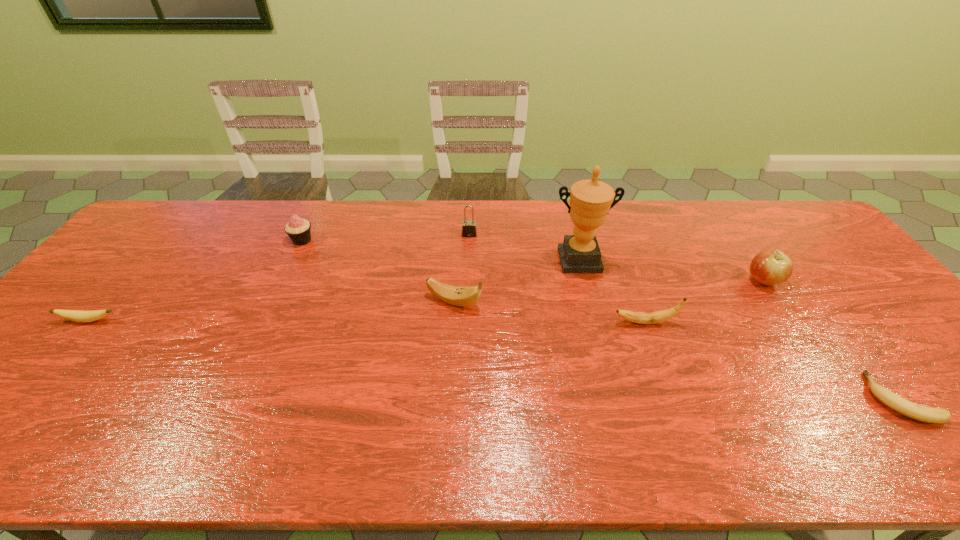
Locate an element on the screen. The height and width of the screenshot is (540, 960). free space located 0.380m at the front of the tallest object with handles is located at coordinates (610, 384).

Find the location of a particular element. vacant point located on the shackle of the padlock is located at coordinates (467, 316).

Locate an element on the screen. vacant space located 0.270m on the back of the second banana from left to right is located at coordinates (459, 233).

Locate an element on the screen. This screenshot has width=960, height=540. free space located on the front of the seventh object from right to left is located at coordinates (274, 301).

I want to click on free spot located 0.090m on the front of the apple, so click(787, 318).

The image size is (960, 540). Identify the location of blank space located 0.260m on the peel of the second banana from right to left from the top. (514, 322).

At what (x,y) coordinates should I click in order to perform the action: click on free region located on the peel of the second banana from right to left from the top. Please return your answer as a coordinate pair (x, y). Image resolution: width=960 pixels, height=540 pixels. Looking at the image, I should click on (465, 322).

The height and width of the screenshot is (540, 960). I want to click on free space located on the peel of the second banana from right to left from the top, so tap(560, 322).

Where is `blank area located on the right of the third tallest banana`? The height and width of the screenshot is (540, 960). blank area located on the right of the third tallest banana is located at coordinates (145, 321).

The width and height of the screenshot is (960, 540). Identify the location of free location located on the left of the rightmost banana. (818, 398).